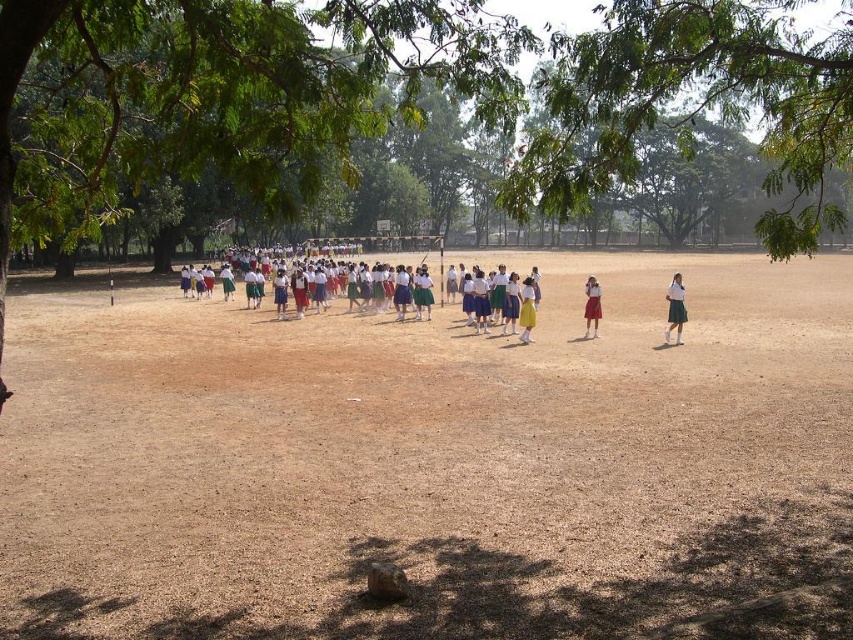
You are standing at the edge of the schoolyard and see the point at coordinates (434, 461). What is the surface type of the ground at that point?

The point at coordinates (434, 461) is on brown sandy ground at center.

You are standing at the edge of the schoolyard looking towards the center. There is a point marked at coordinates (x=434, y=461). What is the location of this point relative to the children and the trees?

The point at coordinates (x=434, y=461) corresponds to the brown sandy ground at center, which is located between the children and the surrounding trees in the schoolyard.

Based on the scene description, where is the green leafy tree at center located in terms of its 2D coordinates?

The green leafy tree at center is located at the 2D coordinates of point (213,90).